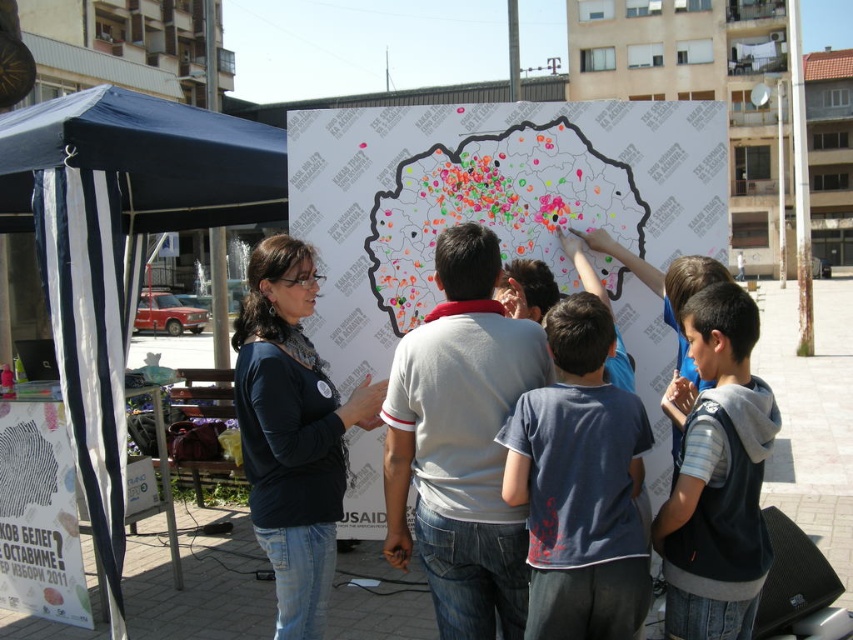
Question: Can you confirm if dark blue t-shirt at center is positioned to the left of white paper poster at lower left?

Choices:
 (A) no
 (B) yes

Answer: (A)

Question: Is white paper map at center closer to the viewer compared to blue fabric canopy at upper left?

Choices:
 (A) no
 (B) yes

Answer: (B)

Question: Among these points, which one is farthest from the camera?

Choices:
 (A) (38, 184)
 (B) (612, 451)
 (C) (283, 236)
 (D) (735, 506)

Answer: (A)

Question: Which is farther from the blue fabric canopy at left?

Choices:
 (A) blue fabric canopy at upper left
 (B) gray hoodie at right

Answer: (B)

Question: Is blue fabric canopy at left wider than gray hoodie at right?

Choices:
 (A) yes
 (B) no

Answer: (A)

Question: Considering the real-world distances, which object is farthest from the dark blue t-shirt at center?

Choices:
 (A) white paper map at center
 (B) blue fabric canopy at left
 (C) white paper poster at lower left

Answer: (C)